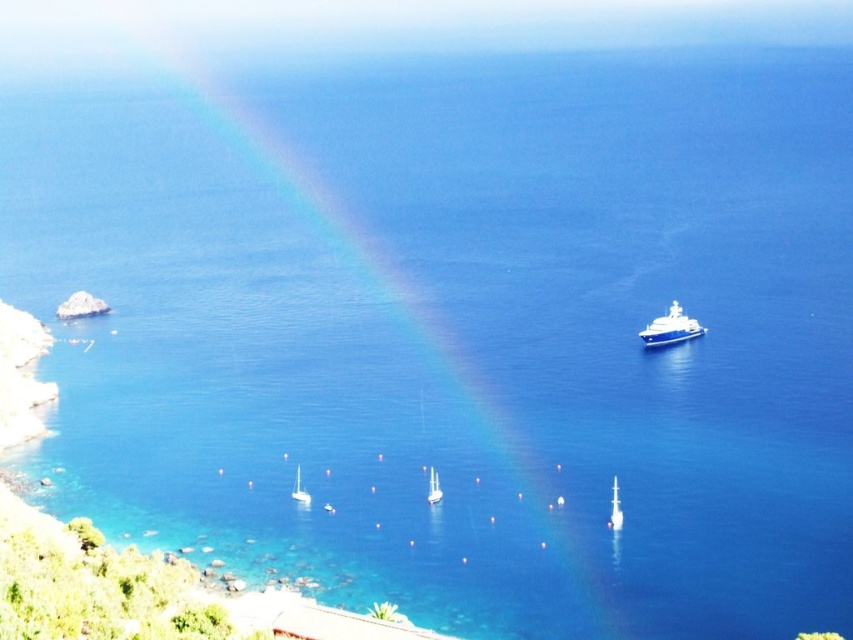
You are standing at the edge of the rocky coastline looking out at the sailboats. There are two points marked on the water. Which point is closer to you, point (618, 502) or point (428, 499)?

Point (618, 502) is closer to you than point (428, 499).

You are a photographer planning to capture the rainbow and the boats in the scene. You want to ensure both the white glossy boat at lower center and the white glossy sailboat at lower center are clearly visible in your shot. Which boat should you focus on first to ensure it appears larger in the photo?

You should focus on the white glossy sailboat at lower center first because it is larger than the white glossy boat at lower center, making it easier to capture clearly in the photo.